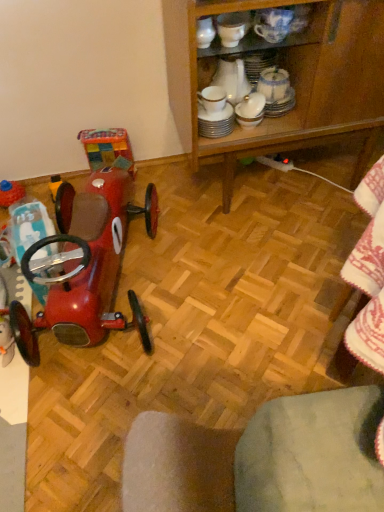
Describe the element at coordinates (10, 193) in the screenshot. I see `shiny red car at left, the second toy viewed from the front` at that location.

Find the location of a particular element. shiny red car at left, which is counted as the 1th toy, starting from the back is located at coordinates (10, 193).

Is wooden cabinet at center not within shiny red car at left, the second toy viewed from the front?

That's correct, wooden cabinet at center is outside of shiny red car at left, the second toy viewed from the front.

From the image's perspective, which one is positioned higher, wooden cabinet at center or shiny red car at left, which ranks as the second toy in right-to-left order?

wooden cabinet at center.

Is wooden cabinet at center positioned far away from shiny red car at left, the second toy viewed from the front?

No, wooden cabinet at center is not far from shiny red car at left, the second toy viewed from the front.

Can you confirm if wooden cabinet at center is smaller than shiny red car at left, which ranks as the second toy in right-to-left order?

No.

Find the location of a particular element. Image resolution: width=384 pixels, height=512 pixels. toy on the right of shiny red car at left, which ranks as the second toy in right-to-left order is located at coordinates (84, 266).

Can you confirm if shiny red car at left, arranged as the 2th toy when viewed from the back, is positioned to the right of shiny red car at left, the second toy viewed from the front?

Yes.

Considering their positions, is shiny red car at left, which is the 1th toy in right-to-left order, located in front of or behind shiny red car at left, which ranks as the second toy in right-to-left order?

Clearly, shiny red car at left, which is the 1th toy in right-to-left order, is in front of shiny red car at left, which ranks as the second toy in right-to-left order.

From the image's perspective, is shiny red car at left, acting as the second toy starting from the left, under shiny red car at left, which ranks as the second toy in right-to-left order?

Correct, shiny red car at left, acting as the second toy starting from the left, appears lower than shiny red car at left, which ranks as the second toy in right-to-left order, in the image.

Which object is more forward, wooden cabinet at center or shiny red car at left, which is the first toy from front to back?

shiny red car at left, which is the first toy from front to back, is more forward.

Based on the photo, does wooden cabinet at center have a lesser width compared to shiny red car at left, acting as the second toy starting from the left?

Yes, wooden cabinet at center is thinner than shiny red car at left, acting as the second toy starting from the left.

Is wooden cabinet at center positioned with its back to shiny red car at left, which is the first toy from front to back?

wooden cabinet at center does not have its back to shiny red car at left, which is the first toy from front to back.

Is wooden cabinet at center to the left or to the right of shiny red car at left, which is the 1th toy in right-to-left order, in the image?

Based on their positions, wooden cabinet at center is located to the right of shiny red car at left, which is the 1th toy in right-to-left order.

Measure the distance between shiny red car at left, which ranks as the second toy in right-to-left order, and shiny red car at left, which is the first toy from front to back.

shiny red car at left, which ranks as the second toy in right-to-left order, and shiny red car at left, which is the first toy from front to back, are 17.18 inches apart.

Looking at the image, does shiny red car at left, the second toy viewed from the front, seem bigger or smaller compared to shiny red car at left, which is the first toy from front to back?

Clearly, shiny red car at left, the second toy viewed from the front, is smaller in size than shiny red car at left, which is the first toy from front to back.

From the picture: Is shiny red car at left, the 1th toy from the left, surrounding shiny red car at left, arranged as the 2th toy when viewed from the back?

No, shiny red car at left, arranged as the 2th toy when viewed from the back, is not surrounded by shiny red car at left, the 1th toy from the left.

Considering the relative sizes of shiny red car at left, which ranks as the second toy in right-to-left order, and shiny red car at left, which is the 1th toy in right-to-left order, in the image provided, is shiny red car at left, which ranks as the second toy in right-to-left order, taller than shiny red car at left, which is the 1th toy in right-to-left order,?

No, shiny red car at left, which ranks as the second toy in right-to-left order, is not taller than shiny red car at left, which is the 1th toy in right-to-left order.

Which object is further away from the camera, shiny red car at left, which is the first toy from front to back, or wooden cabinet at center?

wooden cabinet at center is further away from the camera.

How much distance is there between shiny red car at left, which is the first toy from front to back, and wooden cabinet at center?

They are 21.50 inches apart.

From the picture: Which of these two, shiny red car at left, which is the 1th toy in right-to-left order, or wooden cabinet at center, stands taller?

Standing taller between the two is wooden cabinet at center.

Would you say shiny red car at left, which is the first toy from front to back, is inside or outside wooden cabinet at center?

shiny red car at left, which is the first toy from front to back, is outside wooden cabinet at center.

Is there a large distance between shiny red car at left, the second toy viewed from the front, and wooden cabinet at center?

shiny red car at left, the second toy viewed from the front, is near wooden cabinet at center, not far away.

At what (x,y) coordinates should I click in order to perform the action: click on cabinetry above the shiny red car at left, the second toy viewed from the front (from a real-world perspective). Please return your answer as a coordinate pair (x, y). Looking at the image, I should click on (291, 78).

Could you tell me if shiny red car at left, which ranks as the second toy in right-to-left order, is facing wooden cabinet at center?

No, shiny red car at left, which ranks as the second toy in right-to-left order, is not aimed at wooden cabinet at center.

Which is in front, point (22, 198) or point (326, 88)?

The point (326, 88) is closer.

You are a GUI agent. You are given a task and a screenshot of the screen. Output one action in this format:
    pyautogui.click(x=<x>, y=<y>)
    Task: Click on the cabinetry above the shiny red car at left, which is counted as the 1th toy, starting from the back (from a real-world perspective)
    
    Given the screenshot: What is the action you would take?
    pyautogui.click(x=291, y=78)

This screenshot has width=384, height=512. Find the location of `toy that appears below the shiny red car at left, which is counted as the 1th toy, starting from the back (from the image's perspective)`. toy that appears below the shiny red car at left, which is counted as the 1th toy, starting from the back (from the image's perspective) is located at coordinates (84, 266).

Based on their spatial positions, is shiny red car at left, acting as the second toy starting from the left, or shiny red car at left, the 1th toy from the left, closer to wooden cabinet at center?

Among the two, shiny red car at left, acting as the second toy starting from the left, is located nearer to wooden cabinet at center.

Considering their positions, is shiny red car at left, arranged as the 2th toy when viewed from the back, positioned further to shiny red car at left, the second toy viewed from the front, than wooden cabinet at center?

The object further to shiny red car at left, the second toy viewed from the front, is wooden cabinet at center.

From the image, which object appears to be farther from shiny red car at left, which is the first toy from front to back, wooden cabinet at center or shiny red car at left, the second toy viewed from the front?

The object further to shiny red car at left, which is the first toy from front to back, is wooden cabinet at center.

When comparing their distances from wooden cabinet at center, does shiny red car at left, the 1th toy from the left, or shiny red car at left, which is the first toy from front to back, seem further?

Based on the image, shiny red car at left, the 1th toy from the left, appears to be further to wooden cabinet at center.

Looking at the image, which one is located further to shiny red car at left, the second toy viewed from the front, wooden cabinet at center or shiny red car at left, which is the first toy from front to back?

Among the two, wooden cabinet at center is located further to shiny red car at left, the second toy viewed from the front.

Considering their positions, is shiny red car at left, the 1th toy from the left, positioned further to shiny red car at left, which is the 1th toy in right-to-left order, than wooden cabinet at center?

wooden cabinet at center.

Locate an element on the screen. The height and width of the screenshot is (512, 384). toy between shiny red car at left, which is counted as the 1th toy, starting from the back, and wooden cabinet at center from left to right is located at coordinates (84, 266).